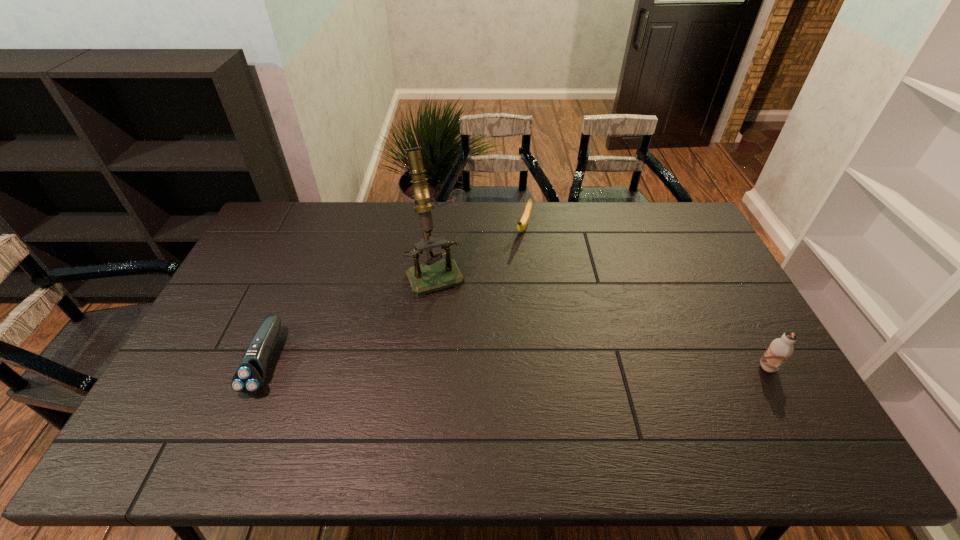
This screenshot has height=540, width=960. Identify the location of free spot on the desktop that is between the electric shaver and the rightmost object and is positioned at the stem of the farthest object. (467, 363).

I want to click on free spot on the desktop that is between the electric shaver and the chocolate milk and is positioned at the eyepiece of the tallest object, so click(477, 363).